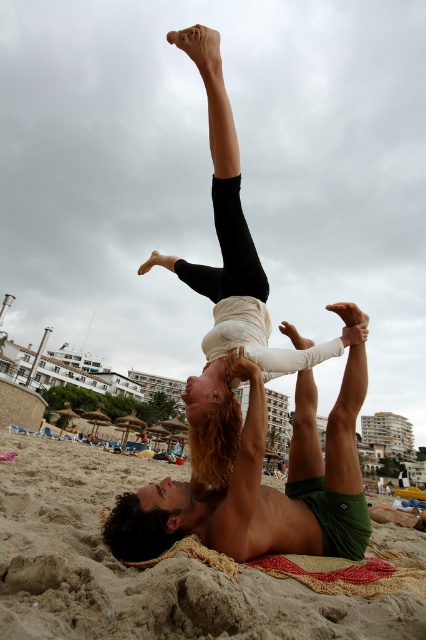
Question: Which is nearer to the white cotton shirt at center?

Choices:
 (A) sandy beach at lower center
 (B) green shorts at center

Answer: (B)

Question: Considering the real-world distances, which object is closest to the white cotton shirt at center?

Choices:
 (A) green shorts at center
 (B) sandy beach at lower center

Answer: (A)

Question: Can you confirm if sandy beach at lower center is positioned below green shorts at center?

Choices:
 (A) yes
 (B) no

Answer: (A)

Question: Is white cotton shirt at center to the left of sandy beach at lower center from the viewer's perspective?

Choices:
 (A) yes
 (B) no

Answer: (B)

Question: Can you confirm if white cotton shirt at center is positioned to the left of sandy beach at lower center?

Choices:
 (A) yes
 (B) no

Answer: (B)

Question: Which point is farther to the camera?

Choices:
 (A) (250, 432)
 (B) (331, 426)

Answer: (B)